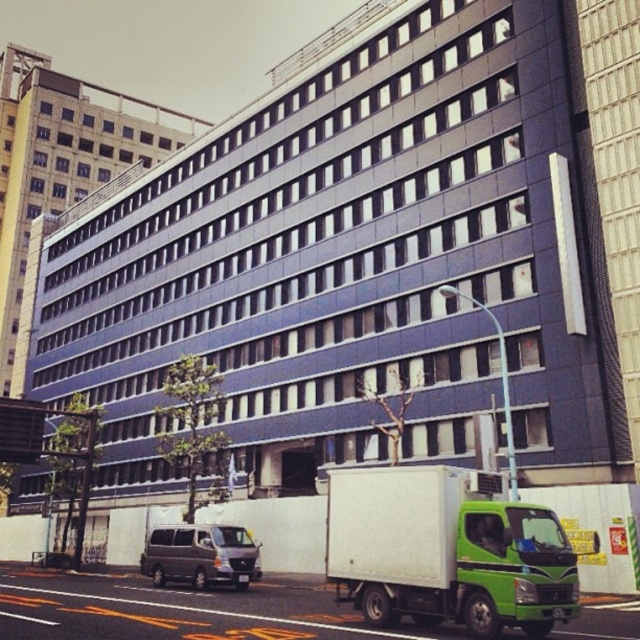
You are a pedestrian standing on the sidewalk in front of the building. You see the green matte truck at lower right and the metallic gray van at lower left. Which vehicle is nearer to you?

The green matte truck at lower right is closer to the viewer than the metallic gray van at lower left.

You are standing at the center of the street looking towards the building. Where is the green matte truck at lower right located in relation to your position?

The green matte truck at lower right is located at coordinates point [445,552], which places it to the right side of the street near the building.